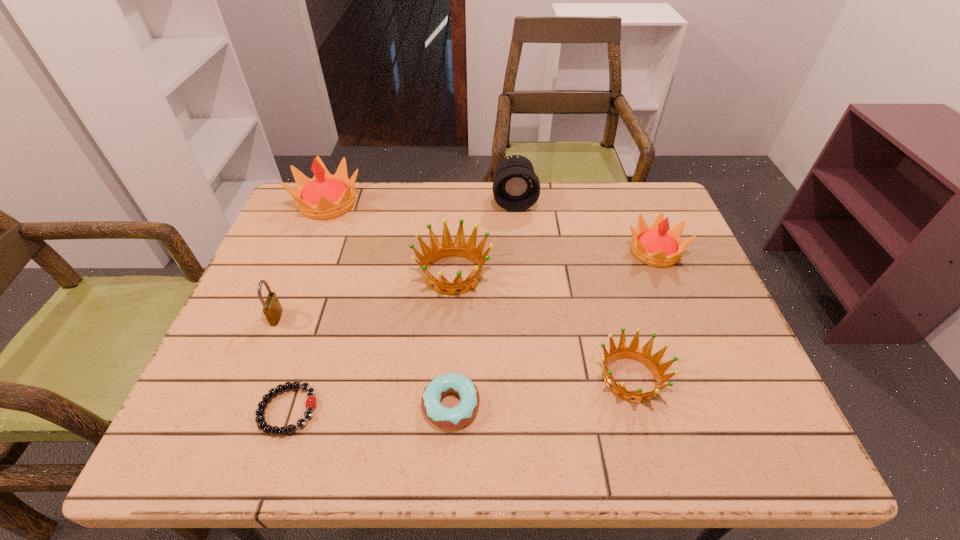
In the image, there is a desktop. In order to click on free space at the far right corner in this screenshot , I will do `click(645, 204)`.

Image resolution: width=960 pixels, height=540 pixels. Identify the location of vacant space at the near right corner. (714, 440).

At what (x,y) coordinates should I click in order to perform the action: click on vacant area that lies between the bigger golden crown and the bigger yellow crown. Please return your answer as a coordinate pair (x, y). The height and width of the screenshot is (540, 960). Looking at the image, I should click on (391, 238).

Where is `unoccupied area between the farther golden crown and the black telephoto lens`? Image resolution: width=960 pixels, height=540 pixels. unoccupied area between the farther golden crown and the black telephoto lens is located at coordinates (484, 237).

What are the coordinates of `empty space that is in between the rightmost object and the third crown from left to right` in the screenshot? It's located at (642, 315).

You are a GUI agent. You are given a task and a screenshot of the screen. Output one action in this format:
    pyautogui.click(x=<x>, y=<y>)
    Task: Click on the free space that is in between the telephoto lens and the bracelet
    The image size is (960, 540).
    Given the screenshot: What is the action you would take?
    pyautogui.click(x=401, y=305)

Where is `unoccupied position between the third shortest object and the smaller yellow crown`? unoccupied position between the third shortest object and the smaller yellow crown is located at coordinates (642, 315).

I want to click on free space between the second shortest crown and the right yellow crown, so click(x=554, y=262).

Identify the location of free space between the doughnut and the rightmost crown. (553, 328).

In order to click on vacant space that's between the third crown from right to left and the seventh tallest object in this screenshot , I will do `click(452, 339)`.